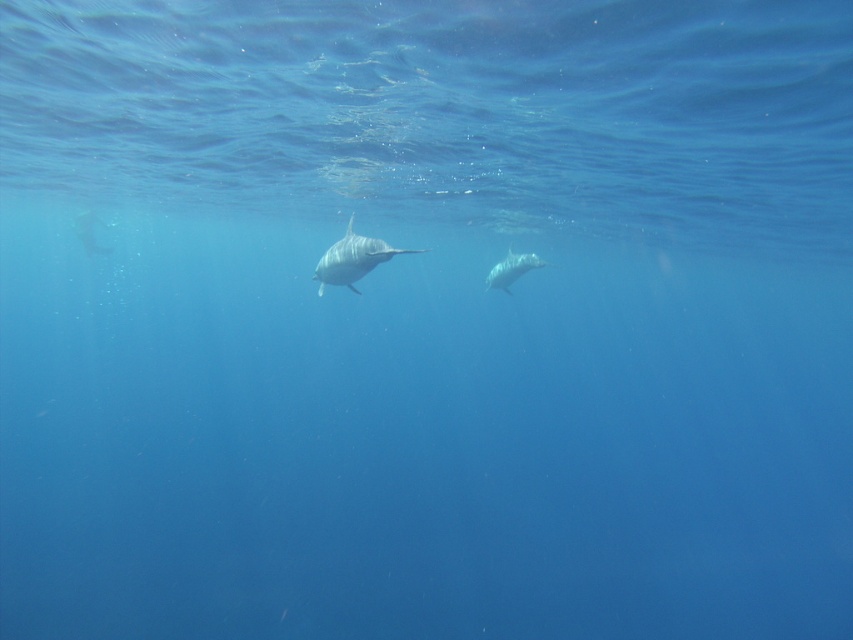
Does point (393, 250) come behind point (502, 276)?

No, (393, 250) is closer to viewer.

Is smooth gray dolphin at center positioned in front of white smooth dolphin at center?

Yes, it is in front of white smooth dolphin at center.

Is point (332, 278) closer to viewer compared to point (520, 273)?

Yes, it is in front of point (520, 273).

Identify the location of smooth gray dolphin at center. Image resolution: width=853 pixels, height=640 pixels. (352, 259).